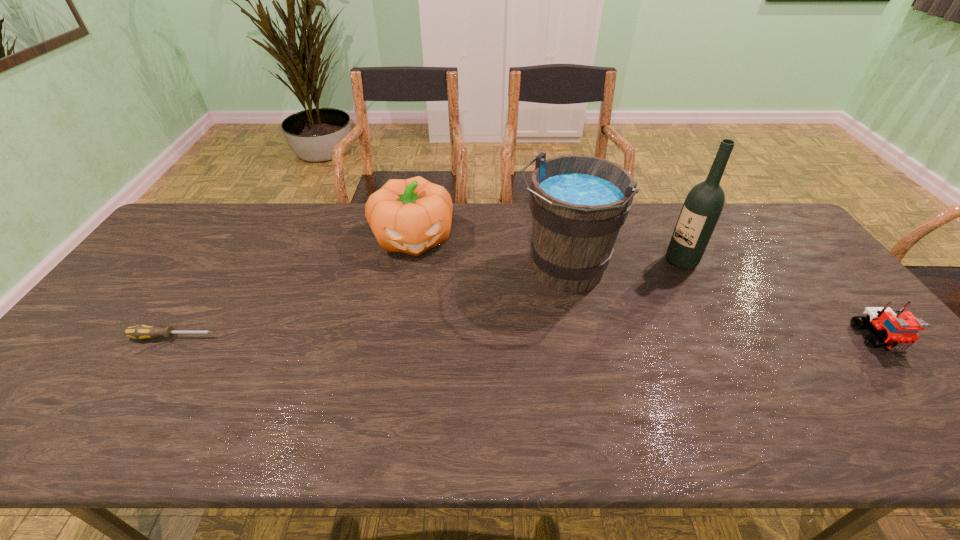
Find the location of `free spot on the desktop that is between the shortest object and the Lego and is positioned on the labeled side of the wine bottle`. free spot on the desktop that is between the shortest object and the Lego and is positioned on the labeled side of the wine bottle is located at coordinates (567, 338).

You are a GUI agent. You are given a task and a screenshot of the screen. Output one action in this format:
    pyautogui.click(x=<x>, y=<y>)
    Task: Click on the vacant spot on the desktop that is between the screwdriver and the second shortest object and is positioned with a handle on the side of the wine bucket
    This screenshot has width=960, height=540.
    Given the screenshot: What is the action you would take?
    pyautogui.click(x=507, y=338)

Identify the location of vacant space on the desktop that is between the leftmost object and the Lego and is positioned on the carved face of the pumpkin. (429, 338).